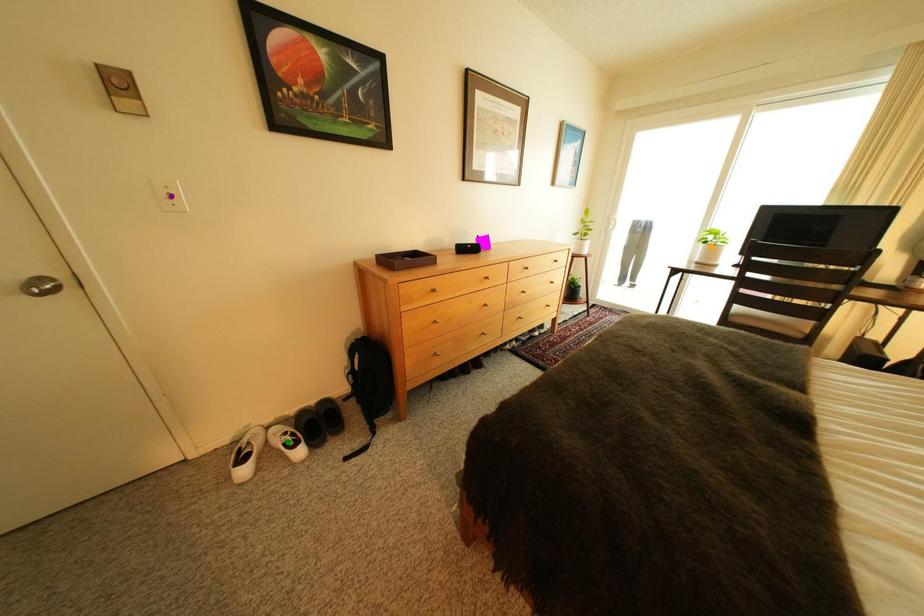
Order these from farthest to nearest:
A) green point
B) orange point
C) purple point

orange point
green point
purple point